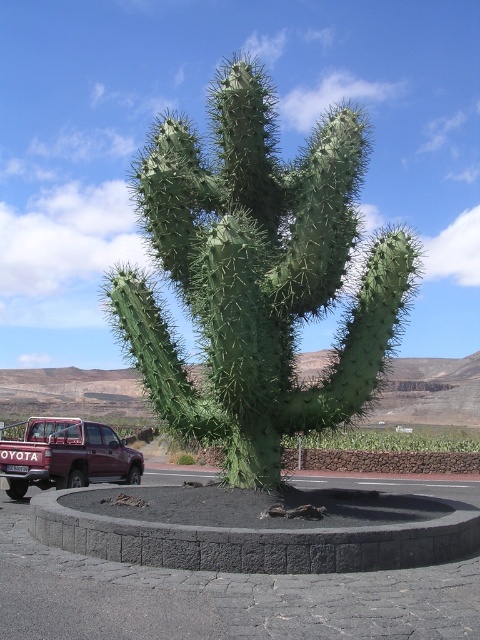
Which is above, black concrete curb at center or maroon metallic truck at lower left?

black concrete curb at center is higher up.

Does black concrete curb at center have a greater height compared to maroon metallic truck at lower left?

No, black concrete curb at center is not taller than maroon metallic truck at lower left.

What are the coordinates of `black concrete curb at center` in the screenshot? It's located at (262, 532).

I want to click on black concrete curb at center, so click(x=262, y=532).

Can you confirm if matte black pickup truck at center is bigger than maroon metallic truck at lower left?

Yes.

Is matte black pickup truck at center wider than maroon metallic truck at lower left?

Correct, the width of matte black pickup truck at center exceeds that of maroon metallic truck at lower left.

Is point (257, 84) positioned in front of point (0, 460)?

Yes, it is in front of point (0, 460).

The image size is (480, 640). Find the location of `matte black pickup truck at center`. matte black pickup truck at center is located at coordinates (259, 273).

Who is positioned more to the right, matte black pickup truck at center or black concrete curb at center?

black concrete curb at center is more to the right.

How far apart are matte black pickup truck at center and black concrete curb at center?

matte black pickup truck at center is 3.74 meters away from black concrete curb at center.

Is point (351, 243) closer to camera compared to point (386, 544)?

No.

Where is `matte black pickup truck at center`? This screenshot has height=640, width=480. matte black pickup truck at center is located at coordinates (259, 273).